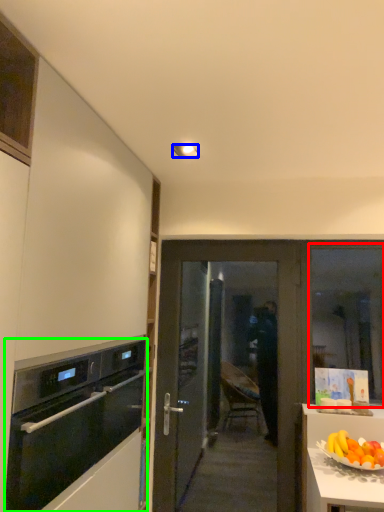
Question: Which object is the closest to the window (highlighted by a red box)? Choose among these: lamp (highlighted by a blue box) or kitchen appliance (highlighted by a green box).

Choices:
 (A) lamp
 (B) kitchen appliance

Answer: (B)